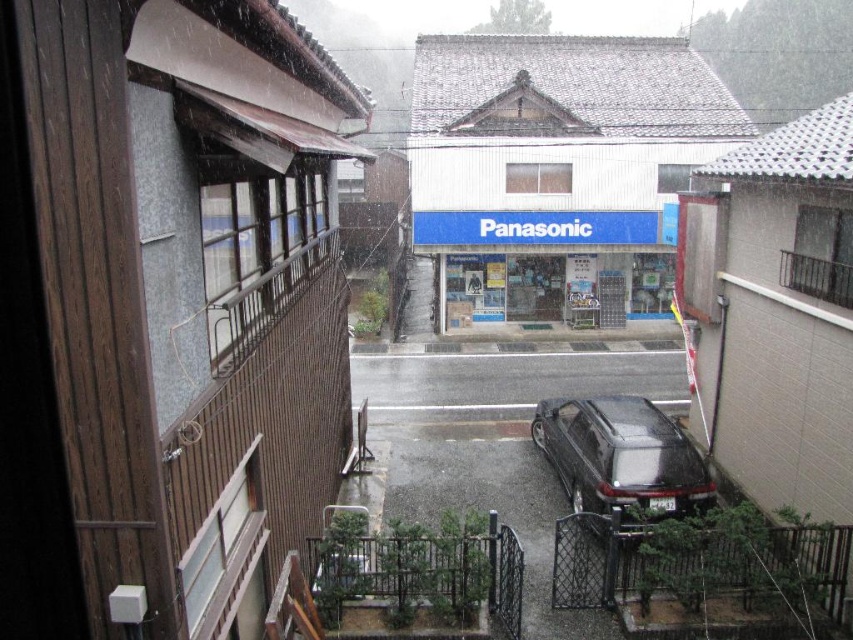
You are standing on the balcony of the brown wood building at left. You want to look down at the black car parked near the gate. In which direction should you turn your head to see the car?

Since the brown wood building at left is located at point [189,294], which is on the left side of the scene, the black car parked near the gate would be to the right of the building. Therefore, you should turn your head to the right to see the car.

You are a delivery person trying to park your vehicle, which is the same width as the glossy black car at lower center. The brown wood building at left is in the way. Can you safely maneuver around it without hitting the building?

The brown wood building at left is thinner than the glossy black car at lower center. Since your vehicle is the same width as the glossy black car at lower center, you should have enough space to maneuver around the building safely as the building is narrower than your vehicle.

You are standing at the point with coordinates point (70, 13) and want to walk towards the point with coordinates point (485, 108). Which direction should you turn to face the correct path?

Since point (70, 13) is in front of point (485, 108), you should turn around to face the direction towards point (485, 108).